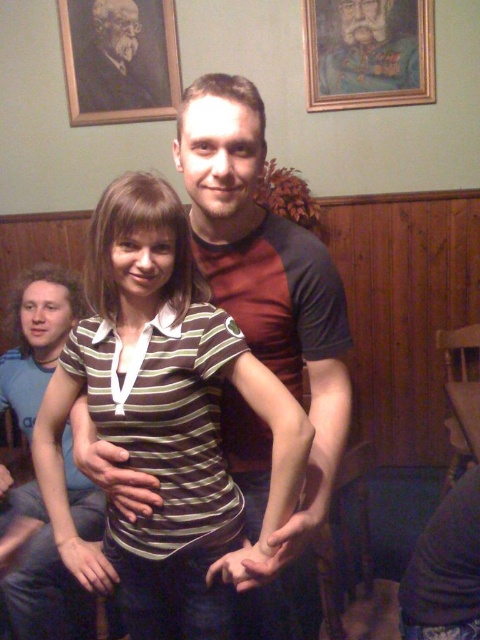
Is striped cotton shirt at center behind wooden picture frame at upper left?

No, striped cotton shirt at center is closer to the viewer.

This screenshot has height=640, width=480. I want to click on striped cotton shirt at center, so click(162, 416).

Is striped cotton shirt at center behind wooden framed portrait at upper center?

No, striped cotton shirt at center is in front of wooden framed portrait at upper center.

In the scene shown: Can you confirm if striped cotton shirt at center is positioned below wooden framed portrait at upper center?

Yes, striped cotton shirt at center is below wooden framed portrait at upper center.

Is point (180, 419) in front of point (379, 93)?

Yes, point (180, 419) is in front of point (379, 93).

You are a GUI agent. You are given a task and a screenshot of the screen. Output one action in this format:
    pyautogui.click(x=<x>, y=<y>)
    Task: Click on the striped cotton shirt at center
    The width and height of the screenshot is (480, 640).
    Given the screenshot: What is the action you would take?
    pyautogui.click(x=162, y=416)

Is wooden picture frame at upper left taller than wooden framed portrait at upper center?

Yes, wooden picture frame at upper left is taller than wooden framed portrait at upper center.

Is wooden picture frame at upper left below wooden framed portrait at upper center?

Actually, wooden picture frame at upper left is above wooden framed portrait at upper center.

This screenshot has width=480, height=640. Describe the element at coordinates (120, 60) in the screenshot. I see `wooden picture frame at upper left` at that location.

This screenshot has height=640, width=480. I want to click on wooden picture frame at upper left, so click(x=120, y=60).